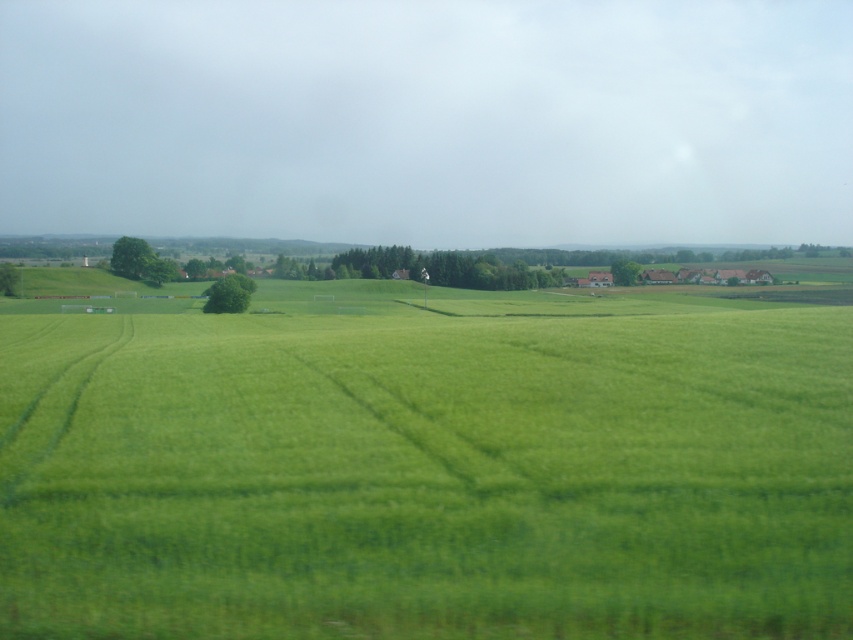
Question: Can you confirm if green leafy tree at center-right is thinner than green grassy tree at left?

Choices:
 (A) no
 (B) yes

Answer: (A)

Question: Is green grassy field at center to the right of green leafy tree at upper left from the viewer's perspective?

Choices:
 (A) no
 (B) yes

Answer: (B)

Question: Is green leafy tree at upper left above green leafy tree at center?

Choices:
 (A) yes
 (B) no

Answer: (A)

Question: Which point is farther to the camera?

Choices:
 (A) green leafy tree at center
 (B) green leafy tree at upper left

Answer: (B)

Question: Which object is the farthest from the green grassy tree at left?

Choices:
 (A) green leafy tree at center-right
 (B) green grassy field at center

Answer: (A)

Question: Which point is farther from the camera taking this photo?

Choices:
 (A) (616, 275)
 (B) (128, 259)
 (C) (242, 301)

Answer: (A)